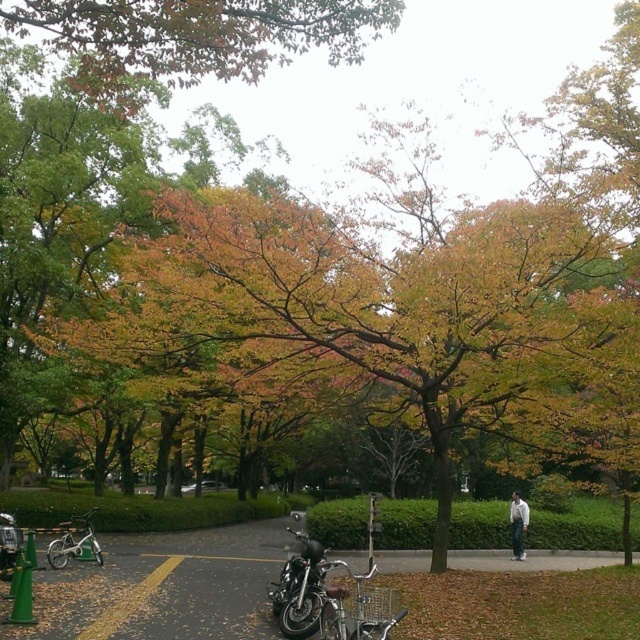
You are standing at the entrance of the park and want to locate the shiny chrome motorcycle at center. Based on the coordinates provided, in which direction should you walk to find it?

The shiny chrome motorcycle at center is located at coordinates point [300,588]. Since the coordinate system typically has [0,0] at the bottom left corner, moving towards higher x values means moving right and higher y values mean moving up. Therefore, to reach the motorcycle, you should walk towards the upper right direction from your current position at the entrance.

You are a pedestrian standing on the paved pathway in the park. You see a silver metallic bicycle at lower left and a shiny black motorcycle at lower left. Which one is positioned more to the right side of the road?

The silver metallic bicycle at lower left is positioned to the right of the shiny black motorcycle at lower left, so the silver metallic bicycle at lower left is more to the right side of the road.